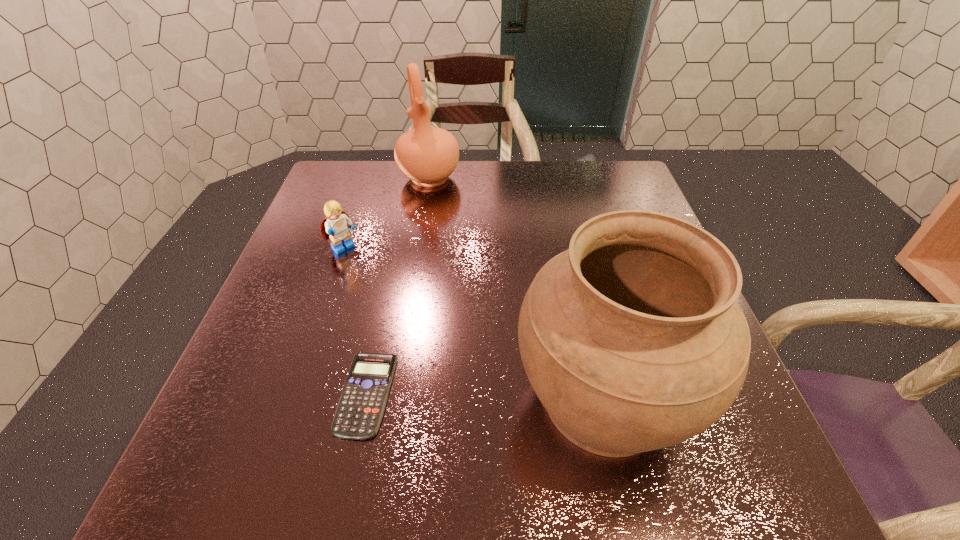
Where is `the shortest object`? the shortest object is located at coordinates (361, 406).

You are a GUI agent. You are given a task and a screenshot of the screen. Output one action in this format:
    pyautogui.click(x=<x>, y=<y>)
    Task: Click on the rightmost object
    This screenshot has height=540, width=960.
    Given the screenshot: What is the action you would take?
    pyautogui.click(x=632, y=339)

You are a GUI agent. You are given a task and a screenshot of the screen. Output one action in this format:
    pyautogui.click(x=<x>, y=<y>)
    Task: Click on the second farthest object
    
    Given the screenshot: What is the action you would take?
    pyautogui.click(x=336, y=226)

The image size is (960, 540). I want to click on the second shortest object, so click(x=336, y=226).

Identify the location of the farthest object. This screenshot has height=540, width=960. (427, 155).

Locate an element on the screen. blank area located 0.180m on the right of the calculator is located at coordinates (494, 394).

I want to click on free space located 0.290m on the back of the urn, so click(567, 238).

What are the coordinates of `vacant space located 0.090m on the front-facing side of the second farthest object` in the screenshot? It's located at (373, 278).

Image resolution: width=960 pixels, height=540 pixels. Identify the location of vacant space located on the front-facing side of the second farthest object. (369, 274).

You are a GUI agent. You are given a task and a screenshot of the screen. Output one action in this format:
    pyautogui.click(x=<x>, y=<y>)
    Task: Click on the vacant space located on the front-facing side of the second farthest object
    
    Given the screenshot: What is the action you would take?
    pyautogui.click(x=423, y=323)